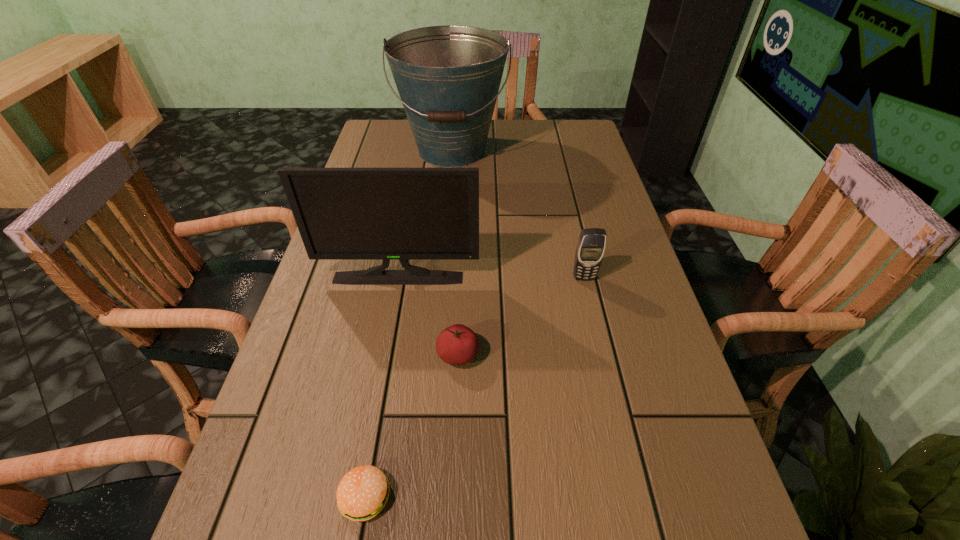
Locate an element on the screen. The height and width of the screenshot is (540, 960). the farthest object is located at coordinates (448, 77).

Where is `bucket`? This screenshot has width=960, height=540. bucket is located at coordinates (448, 77).

Find the location of a particular element. This screenshot has width=960, height=540. the second tallest object is located at coordinates (403, 214).

Locate an element on the screen. the rightmost object is located at coordinates (590, 249).

At what (x,y) coordinates should I click in order to perform the action: click on the third shortest object. Please return your answer as a coordinate pair (x, y). Image resolution: width=960 pixels, height=540 pixels. Looking at the image, I should click on (590, 249).

The image size is (960, 540). What are the coordinates of `tomato` in the screenshot? It's located at (457, 345).

You are a GUI agent. You are given a task and a screenshot of the screen. Output one action in this format:
    pyautogui.click(x=<x>, y=<y>)
    Task: Click on the second nearest object
    The image size is (960, 540).
    Given the screenshot: What is the action you would take?
    pyautogui.click(x=457, y=345)

The height and width of the screenshot is (540, 960). I want to click on the shortest object, so click(x=363, y=492).

Locate an element on the screen. the nearest object is located at coordinates (363, 492).

You are a GUI agent. You are given a task and a screenshot of the screen. Output one action in this format:
    pyautogui.click(x=<x>, y=<y>)
    Task: Click on the free region located 0.300m with the handle on opposite sides of the tallest object
    
    Given the screenshot: What is the action you would take?
    pyautogui.click(x=444, y=245)